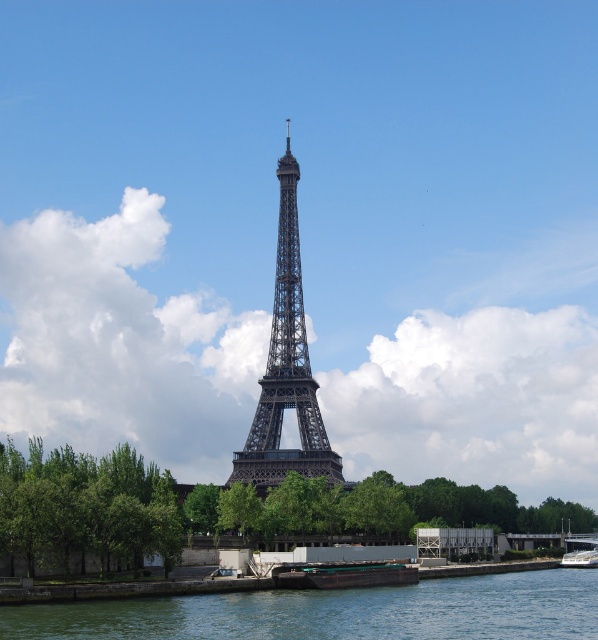
You are a photographer planning to capture the Eiffel Tower from the water. You have a drone that can fly over the green water at lower center and the green matte barge at lower center. According to the scene, which object should the drone fly over first to reach the tower?

The green water at lower center is to the left of the green matte barge at lower center, so the drone should fly over the green water at lower center first to reach the tower.

You are a tour guide on a sightseeing boat and want to approach the Eiffel Tower. Your boat is the metallic polished boat at lower right. There is a green matte barge at lower center blocking your path. Can you safely navigate around it to reach the tower? The distance between the two boats is 33.09 meters. Your boat requires a minimum of 25 meters to maneuver safely. Please state your decision and reasoning based on the distance provided.

The metallic polished boat at lower right needs at least 25 meters to maneuver safely. Since the green matte barge at lower center is 33.09 meters away, there is sufficient space to navigate around it. Therefore, you can safely maneuver around the green matte barge at lower center to reach the Eiffel Tower.

You are a tourist standing on the shore of the Eiffel Tower viewing area. You see the green matte barge at lower center and the metallic polished boat at lower right. Which one is closer to the left side of your view?

The green matte barge at lower center is to the left of the metallic polished boat at lower right, so it is closer to the left side of your view.